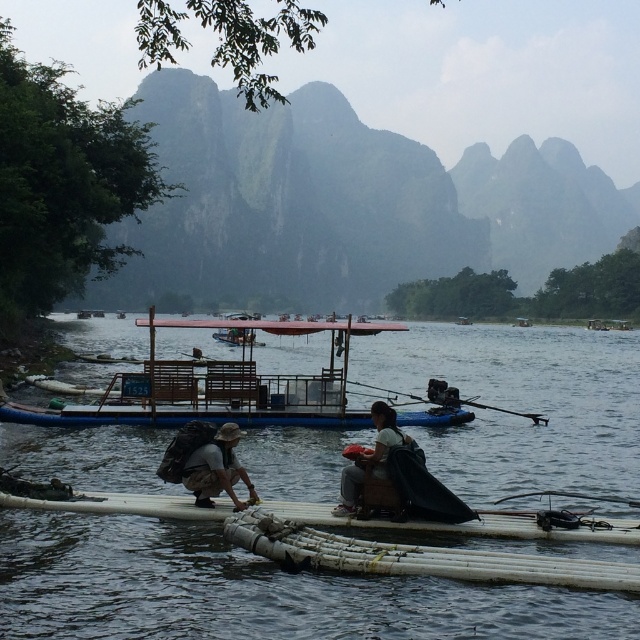
Question: Which object is positioned farthest from the wooden boat at center?

Choices:
 (A) brown fabric hat at lower center
 (B) natural bamboo raft at lower center

Answer: (B)

Question: Which point is farther to the camera?

Choices:
 (A) natural bamboo raft at lower center
 (B) brown fabric hat at lower center
 (C) wooden boat at center

Answer: (C)

Question: Is wooden boat at center behind matte brown backpack at center?

Choices:
 (A) yes
 (B) no

Answer: (A)

Question: Does white bamboo raft at center appear on the left side of natural bamboo raft at lower center?

Choices:
 (A) no
 (B) yes

Answer: (B)

Question: Does white bamboo raft at center lie in front of natural bamboo raft at lower center?

Choices:
 (A) no
 (B) yes

Answer: (B)

Question: Which is farther from the brown fabric hat at lower center?

Choices:
 (A) white bamboo raft at center
 (B) matte brown backpack at center

Answer: (A)